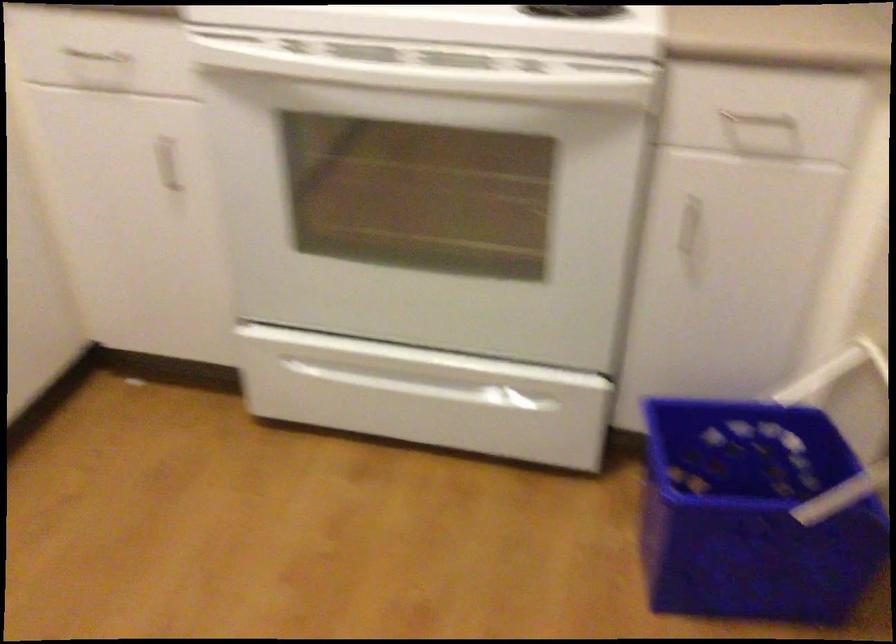
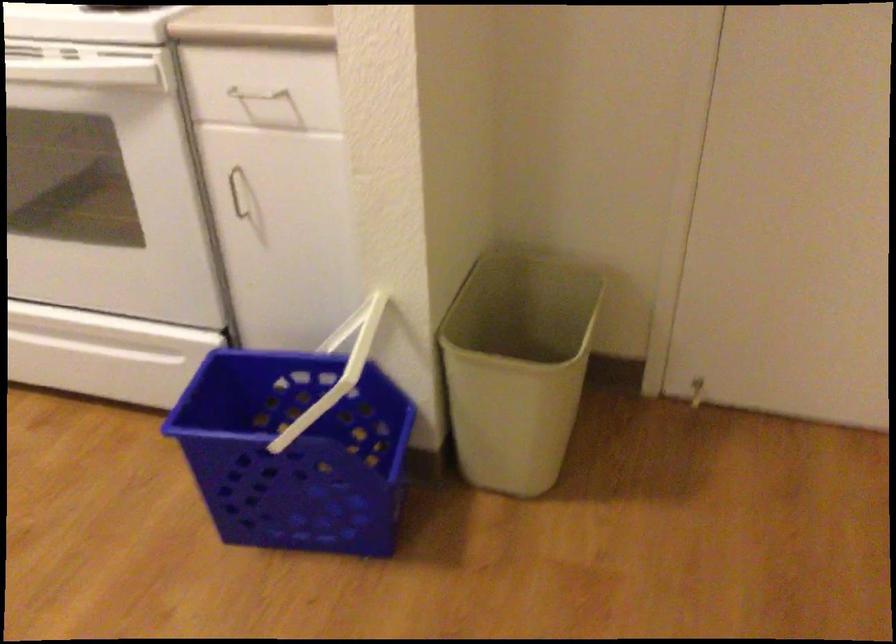
Question: In a continuous first-person perspective shot, in which direction is the camera moving?

Choices:
 (A) Left
 (B) Right
 (C) Forward
 (D) Backward

Answer: (B)